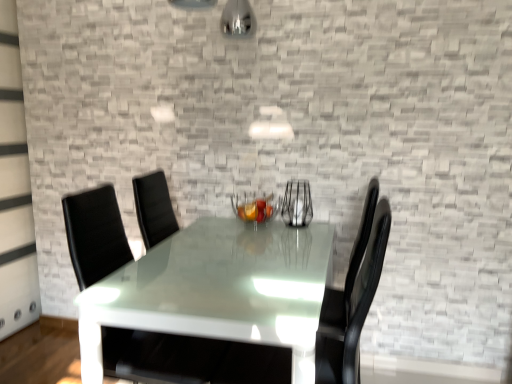
Question: Considering the relative positions of glossy white table at center and black leather swivel chair at center in the image provided, is glossy white table at center behind black leather swivel chair at center?

Choices:
 (A) yes
 (B) no

Answer: (B)

Question: Does glossy white table at center have a smaller size compared to black leather swivel chair at center?

Choices:
 (A) no
 (B) yes

Answer: (A)

Question: Considering the relative sizes of glossy white table at center and black leather swivel chair at center in the image provided, is glossy white table at center shorter than black leather swivel chair at center?

Choices:
 (A) no
 (B) yes

Answer: (B)

Question: Is glossy white table at center facing away from black leather swivel chair at center?

Choices:
 (A) no
 (B) yes

Answer: (B)

Question: Is glossy white table at center bigger than black leather swivel chair at center?

Choices:
 (A) yes
 (B) no

Answer: (A)

Question: Considering the positions of clear glass vase at center and glossy white table at center in the image, is clear glass vase at center taller or shorter than glossy white table at center?

Choices:
 (A) short
 (B) tall

Answer: (A)

Question: Considering the positions of point (285, 221) and point (271, 327), is point (285, 221) closer or farther from the camera than point (271, 327)?

Choices:
 (A) farther
 (B) closer

Answer: (A)

Question: Based on their positions, is clear glass vase at center located to the left or right of glossy white table at center?

Choices:
 (A) left
 (B) right

Answer: (B)

Question: From the image's perspective, is clear glass vase at center positioned above or below glossy white table at center?

Choices:
 (A) above
 (B) below

Answer: (A)

Question: Is clear glass vase at center in front of or behind black leather swivel chair at center in the image?

Choices:
 (A) behind
 (B) front

Answer: (A)

Question: Looking at their shapes, would you say clear glass vase at center is wider or thinner than black leather swivel chair at center?

Choices:
 (A) thin
 (B) wide

Answer: (A)

Question: From a real-world perspective, is clear glass vase at center physically located above or below black leather swivel chair at center?

Choices:
 (A) above
 (B) below

Answer: (A)

Question: Based on their positions, is clear glass vase at center located to the left or right of black leather swivel chair at center?

Choices:
 (A) left
 (B) right

Answer: (B)

Question: Looking at their shapes, would you say metallic wire basket at center is wider or thinner than black leather swivel chair at center?

Choices:
 (A) wide
 (B) thin

Answer: (B)

Question: From a real-world perspective, is metallic wire basket at center above or below black leather swivel chair at center?

Choices:
 (A) below
 (B) above

Answer: (B)